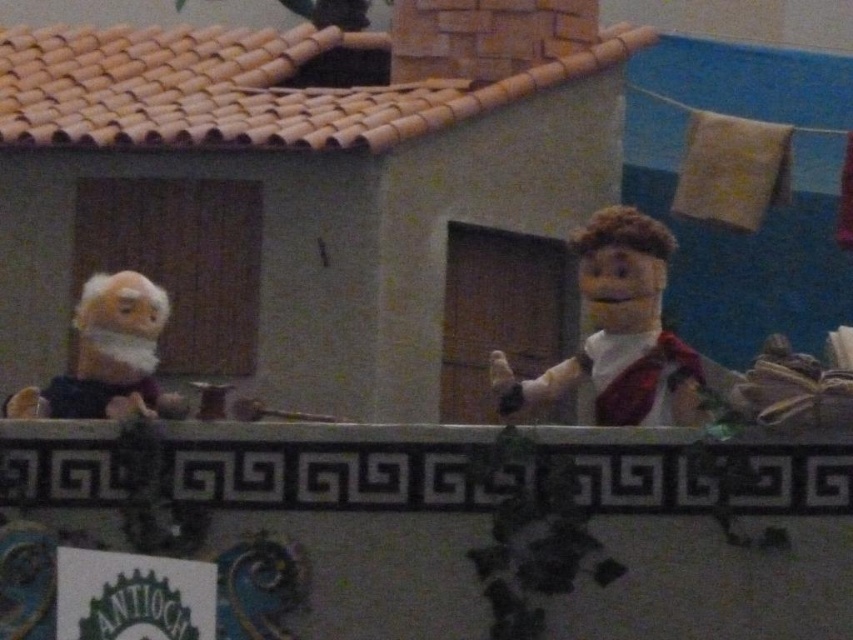
Is white fabric puppet at center taller than white plush monkey at left?

Yes.

Does white fabric puppet at center have a smaller size compared to white plush monkey at left?

Incorrect, white fabric puppet at center is not smaller in size than white plush monkey at left.

Which is in front, point (614, 404) or point (51, 388)?

Point (614, 404) is in front.

Identify the location of white fabric puppet at center. (619, 332).